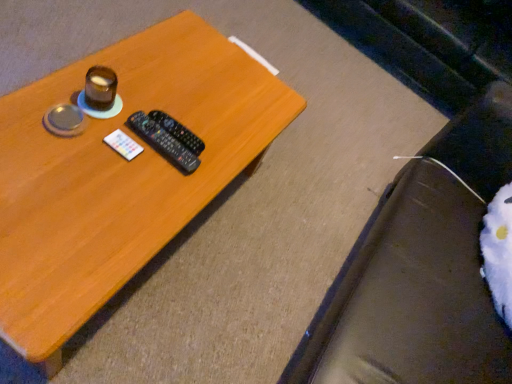
At what (x,y) coordinates should I click in order to perform the action: click on black plastic remote control at center, placed as the second remote control when sorted from front to back. Please return your answer as a coordinate pair (x, y). This screenshot has height=384, width=512. Looking at the image, I should click on (178, 131).

Image resolution: width=512 pixels, height=384 pixels. Describe the element at coordinates (178, 131) in the screenshot. I see `black plastic remote control at center, placed as the second remote control when sorted from front to back` at that location.

Locate an element on the screen. black plastic remote at center, placed as the second remote control when sorted from back to front is located at coordinates (163, 142).

This screenshot has width=512, height=384. What do you see at coordinates (100, 88) in the screenshot?
I see `shiny brown cup at upper left` at bounding box center [100, 88].

This screenshot has height=384, width=512. Identify the location of wooden table at center. (120, 173).

Who is shorter, shiny brown cup at upper left or white fuzzy bean bag chair at lower right?

shiny brown cup at upper left is shorter.

Which object is more forward, shiny brown cup at upper left or white fuzzy bean bag chair at lower right?

Positioned in front is white fuzzy bean bag chair at lower right.

Does shiny brown cup at upper left turn towards white fuzzy bean bag chair at lower right?

Yes, shiny brown cup at upper left is aimed at white fuzzy bean bag chair at lower right.

Is shiny brown cup at upper left to the right of white fuzzy bean bag chair at lower right from the viewer's perspective?

Incorrect, shiny brown cup at upper left is not on the right side of white fuzzy bean bag chair at lower right.

Image resolution: width=512 pixels, height=384 pixels. Identify the location of table on the left of the black plastic remote at center, which is the 1th remote control in front-to-back order. (120, 173).

Can you confirm if black plastic remote at center, placed as the second remote control when sorted from back to front, is thinner than wooden table at center?

Indeed, black plastic remote at center, placed as the second remote control when sorted from back to front, has a lesser width compared to wooden table at center.

Consider the image. Between black plastic remote at center, placed as the second remote control when sorted from back to front, and wooden table at center, which one has more height?

With more height is wooden table at center.

From the image's perspective, relative to wooden table at center, is black plastic remote at center, which is the 1th remote control in front-to-back order, above or below?

black plastic remote at center, which is the 1th remote control in front-to-back order, is above wooden table at center.

Looking at this image, can you tell me how much white fuzzy bean bag chair at lower right and black plastic remote control at center, placed as the second remote control when sorted from front to back, differ in facing direction?

179 degrees separate the facing orientations of white fuzzy bean bag chair at lower right and black plastic remote control at center, placed as the second remote control when sorted from front to back.

Does white fuzzy bean bag chair at lower right turn towards black plastic remote control at center, the 1th remote control viewed from the back?

Yes, white fuzzy bean bag chair at lower right is oriented towards black plastic remote control at center, the 1th remote control viewed from the back.

Is white fuzzy bean bag chair at lower right at the left side of black plastic remote control at center, the 1th remote control viewed from the back?

Incorrect, white fuzzy bean bag chair at lower right is not on the left side of black plastic remote control at center, the 1th remote control viewed from the back.

From a real-world perspective, does white fuzzy bean bag chair at lower right sit lower than black plastic remote control at center, the 1th remote control viewed from the back?

No, from a real-world perspective, white fuzzy bean bag chair at lower right is not beneath black plastic remote control at center, the 1th remote control viewed from the back.

From the image's perspective, is shiny brown cup at upper left beneath wooden table at center?

No, from the image's perspective, shiny brown cup at upper left is not beneath wooden table at center.

Where is `coffee cup above the wooden table at center (from a real-world perspective)`? coffee cup above the wooden table at center (from a real-world perspective) is located at coordinates (100, 88).

Is shiny brown cup at upper left smaller than wooden table at center?

Correct, shiny brown cup at upper left occupies less space than wooden table at center.

Is shiny brown cup at upper left not close to wooden table at center?

No, there isn't a large distance between shiny brown cup at upper left and wooden table at center.

Which object is more forward, black plastic remote control at center, placed as the second remote control when sorted from front to back, or white fuzzy bean bag chair at lower right?

white fuzzy bean bag chair at lower right is in front.

Considering the sizes of black plastic remote control at center, placed as the second remote control when sorted from front to back, and white fuzzy bean bag chair at lower right in the image, is black plastic remote control at center, placed as the second remote control when sorted from front to back, bigger or smaller than white fuzzy bean bag chair at lower right?

Considering their sizes, black plastic remote control at center, placed as the second remote control when sorted from front to back, takes up less space than white fuzzy bean bag chair at lower right.

Can you confirm if black plastic remote control at center, the 1th remote control viewed from the back, is taller than white fuzzy bean bag chair at lower right?

Incorrect, the height of black plastic remote control at center, the 1th remote control viewed from the back, is not larger of that of white fuzzy bean bag chair at lower right.

Based on the photo, would you say black plastic remote control at center, the 1th remote control viewed from the back, is outside white fuzzy bean bag chair at lower right?

black plastic remote control at center, the 1th remote control viewed from the back, is positioned outside white fuzzy bean bag chair at lower right.

From the image's perspective, starting from the wooden table at center, which remote control is the 2nd one above? Please provide its 2D coordinates.

[(178, 131)]

Can you tell me how much wooden table at center and black plastic remote control at center, placed as the second remote control when sorted from front to back, differ in facing direction?

179 degrees.

Can black plastic remote control at center, placed as the second remote control when sorted from front to back, be found inside wooden table at center?

Yes.

Is the surface of black plastic remote at center, which is the 1th remote control in front-to-back order, in direct contact with white fuzzy bean bag chair at lower right?

No, black plastic remote at center, which is the 1th remote control in front-to-back order, is not in contact with white fuzzy bean bag chair at lower right.

Which is in front, point (178, 144) or point (430, 226)?

The point (178, 144) is closer to the camera.

Is black plastic remote at center, which is the 1th remote control in front-to-back order, spatially inside white fuzzy bean bag chair at lower right, or outside of it?

black plastic remote at center, which is the 1th remote control in front-to-back order, exists outside the volume of white fuzzy bean bag chair at lower right.

Which is more to the left, black plastic remote at center, placed as the second remote control when sorted from back to front, or white fuzzy bean bag chair at lower right?

black plastic remote at center, placed as the second remote control when sorted from back to front.

I want to click on coffee cup above the white fuzzy bean bag chair at lower right (from a real-world perspective), so click(x=100, y=88).

At what (x,y) coordinates should I click in order to perform the action: click on table below the black plastic remote at center, which is the 1th remote control in front-to-back order (from a real-world perspective). Please return your answer as a coordinate pair (x, y). Image resolution: width=512 pixels, height=384 pixels. Looking at the image, I should click on (120, 173).

Looking at this image, based on their spatial positions, is shiny brown cup at upper left or black plastic remote control at center, the 1th remote control viewed from the back, closer to black plastic remote at center, which is the 1th remote control in front-to-back order?

The object closer to black plastic remote at center, which is the 1th remote control in front-to-back order, is black plastic remote control at center, the 1th remote control viewed from the back.

From the image, which object appears to be farther from shiny brown cup at upper left, white fuzzy bean bag chair at lower right or wooden table at center?

Based on the image, white fuzzy bean bag chair at lower right appears to be further to shiny brown cup at upper left.

Looking at the image, which one is located closer to shiny brown cup at upper left, black plastic remote at center, placed as the second remote control when sorted from back to front, or black plastic remote control at center, placed as the second remote control when sorted from front to back?

Based on the image, black plastic remote at center, placed as the second remote control when sorted from back to front, appears to be nearer to shiny brown cup at upper left.

Which object lies nearer to the anchor point black plastic remote at center, placed as the second remote control when sorted from back to front, wooden table at center or black plastic remote control at center, the 1th remote control viewed from the back?

black plastic remote control at center, the 1th remote control viewed from the back, is positioned closer to the anchor black plastic remote at center, placed as the second remote control when sorted from back to front.

Considering their positions, is black plastic remote at center, which is the 1th remote control in front-to-back order, positioned closer to white fuzzy bean bag chair at lower right than wooden table at center?

wooden table at center is closer to white fuzzy bean bag chair at lower right.

Looking at this image, looking at the image, which one is located further to shiny brown cup at upper left, black plastic remote at center, placed as the second remote control when sorted from back to front, or wooden table at center?

The object further to shiny brown cup at upper left is wooden table at center.

Estimate the real-world distances between objects in this image. Which object is closer to wooden table at center, black plastic remote control at center, placed as the second remote control when sorted from front to back, or white fuzzy bean bag chair at lower right?

Based on the image, black plastic remote control at center, placed as the second remote control when sorted from front to back, appears to be nearer to wooden table at center.

From the image, which object appears to be nearer to black plastic remote at center, which is the 1th remote control in front-to-back order, shiny brown cup at upper left or white fuzzy bean bag chair at lower right?

shiny brown cup at upper left lies closer to black plastic remote at center, which is the 1th remote control in front-to-back order, than the other object.

The width and height of the screenshot is (512, 384). Identify the location of remote control between wooden table at center and black plastic remote control at center, the 1th remote control viewed from the back, in the front-back direction. (163, 142).

This screenshot has width=512, height=384. In order to click on table situated between shiny brown cup at upper left and white fuzzy bean bag chair at lower right from left to right in this screenshot , I will do `click(120, 173)`.

Locate an element on the screen. The height and width of the screenshot is (384, 512). coffee cup between wooden table at center and black plastic remote control at center, placed as the second remote control when sorted from front to back, along the z-axis is located at coordinates click(x=100, y=88).

This screenshot has height=384, width=512. In order to click on coffee cup between wooden table at center and black plastic remote at center, which is the 1th remote control in front-to-back order, from front to back in this screenshot , I will do `click(100, 88)`.